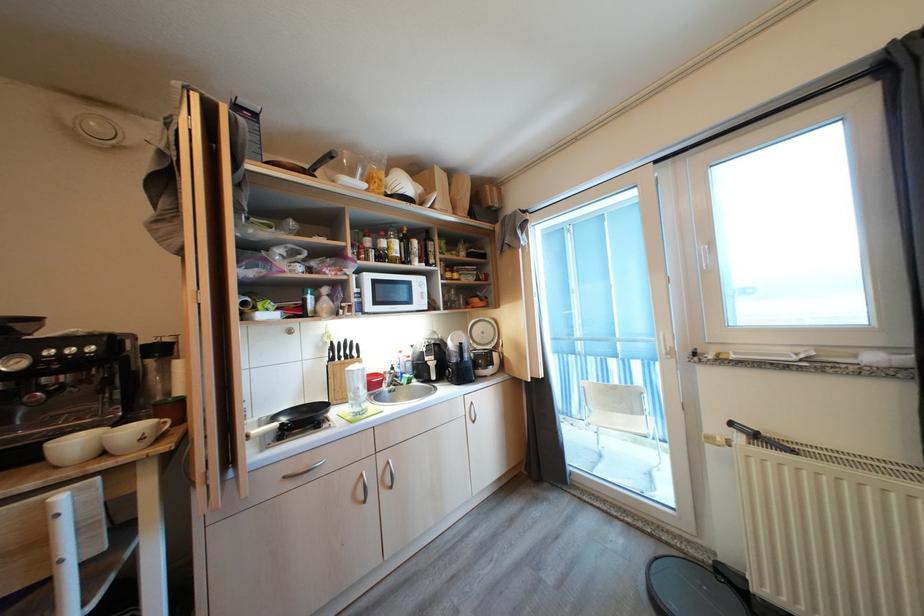
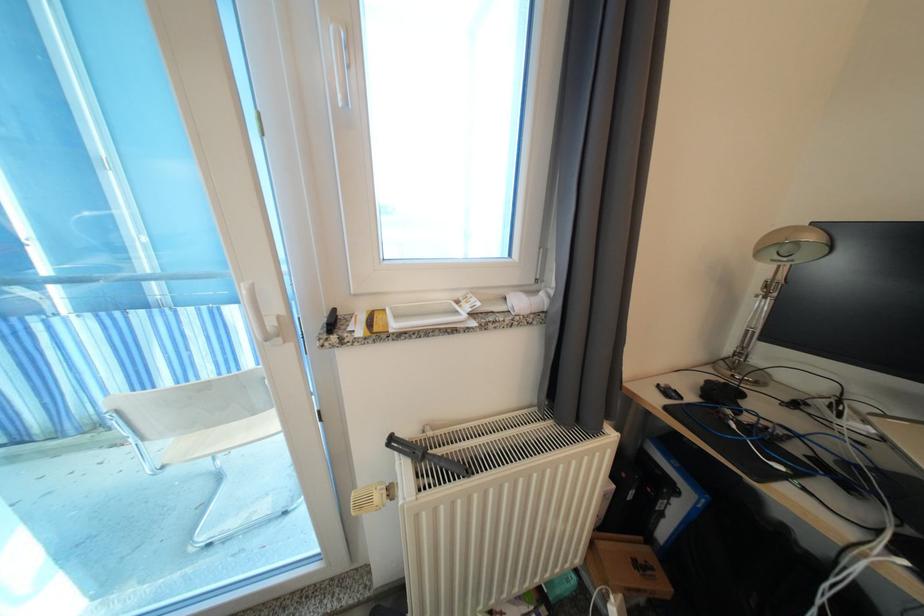
Where in the second image is the point corresponding to the point at 737,361 from the first image?

(398, 330)